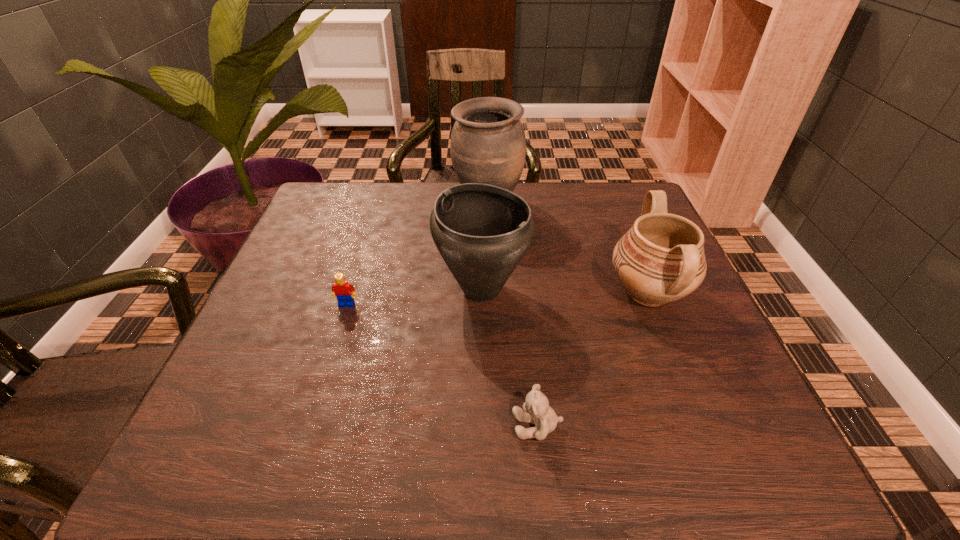
This screenshot has width=960, height=540. I want to click on vacant space located 0.260m on the face of the nearest object, so click(x=354, y=426).

Locate an element on the screen. vacant space situated on the face of the nearest object is located at coordinates (402, 426).

Locate an element on the screen. The width and height of the screenshot is (960, 540). free point located 0.320m on the face of the nearest object is located at coordinates (318, 426).

The width and height of the screenshot is (960, 540). I want to click on object that is at the far edge, so click(488, 145).

The width and height of the screenshot is (960, 540). I want to click on object present at the near edge, so click(537, 411).

You are a GUI agent. You are given a task and a screenshot of the screen. Output one action in this format:
    pyautogui.click(x=<x>, y=<y>)
    Task: Click on the object present at the left edge
    
    Given the screenshot: What is the action you would take?
    pyautogui.click(x=341, y=289)

The image size is (960, 540). In order to click on object at the right edge in this screenshot , I will do `click(661, 259)`.

Where is `free space at the far edge of the desktop`? This screenshot has height=540, width=960. free space at the far edge of the desktop is located at coordinates (519, 192).

You are a GUI agent. You are given a task and a screenshot of the screen. Output one action in this format:
    pyautogui.click(x=<x>, y=<y>)
    Task: Click on the vacant space at the near edge
    This screenshot has height=540, width=960.
    Given the screenshot: What is the action you would take?
    pyautogui.click(x=666, y=463)

In the image, there is a desktop. At what (x,y) coordinates should I click in order to perform the action: click on vacant space at the left edge. Please return your answer as a coordinate pair (x, y). The width and height of the screenshot is (960, 540). Looking at the image, I should click on (334, 234).